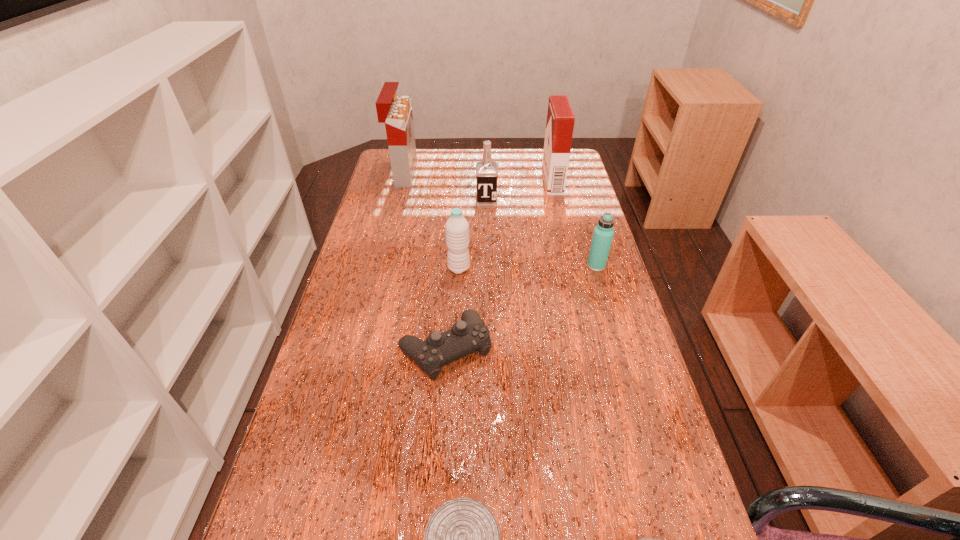
The image size is (960, 540). I want to click on vacant space at the left edge of the desktop, so click(x=313, y=406).

In the image, there is a desktop. Where is `free space at the right edge`? The image size is (960, 540). free space at the right edge is located at coordinates (572, 300).

Identify the location of free region at the far left corner of the desktop. The height and width of the screenshot is (540, 960). (421, 150).

Identify the location of free space between the leftmost object and the control. (424, 261).

Locate an element on the screen. blank region between the thermos bottle and the vodka is located at coordinates (541, 234).

At what (x,y) coordinates should I click in order to perform the action: click on free space between the sixth nearest object and the water bottle. Please return your answer as a coordinate pair (x, y). Looking at the image, I should click on (472, 235).

Find the location of a particular element. This screenshot has width=960, height=540. blank region between the thermos bottle and the control is located at coordinates (521, 307).

Where is `vacant area that lies between the thermos bottle and the right cigarette_case`? vacant area that lies between the thermos bottle and the right cigarette_case is located at coordinates (574, 224).

Locate an element on the screen. This screenshot has height=540, width=960. empty space that is in between the water bottle and the leftmost object is located at coordinates (431, 221).

Identify which object is the fifth closest to the thermos bottle. Please provide its 2D coordinates. Your answer should be formatted as a tuple, i.e. [(x, y)], where the tuple contains the x and y coordinates of a point satisfying the conditions above.

[(396, 112)]